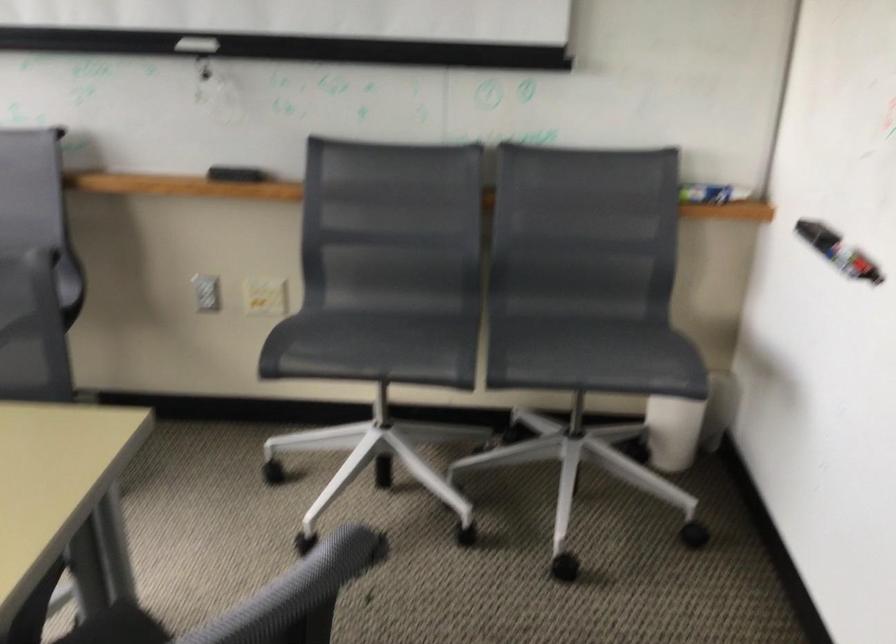
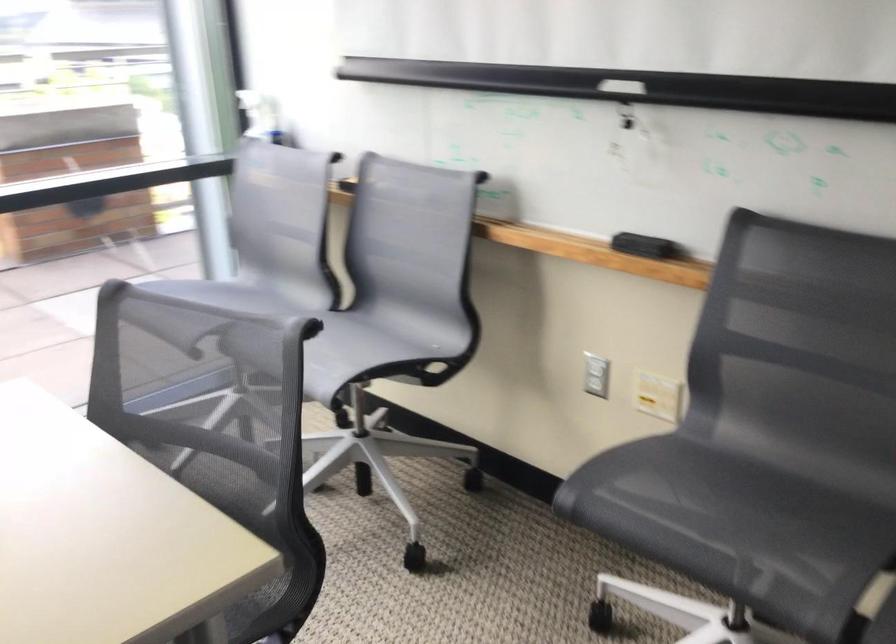
Question: I am providing you with two images of the same scene from different viewpoints. Which of the following objects are not visible in image2?

Choices:
 (A) gray chair sitting surface
 (B) white light switch
 (C) black whiteboard eraser
 (D) none of these

Answer: (D)